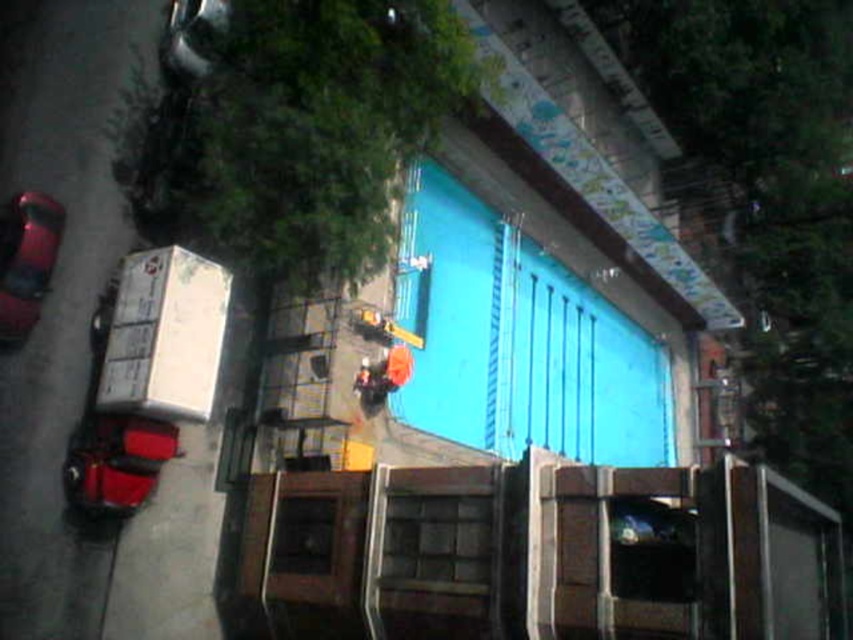
You are standing at the point marked by the coordinates in the image. Looking around, you see a blue wall with vertical lines and a decorative pattern at the top edge. There is a red vehicle partially visible to the left. What object is located at the coordinates point (x=26, y=260)?

The point (x=26, y=260) marks the shiny red car at left.

You are standing at the center of the sidewalk in the urban street scene. You want to move to the shiny red car at left. Which direction should you walk?

You should walk to the left because the shiny red car at left is located at point [26,260], which is to the left of your current position at the center of the sidewalk.